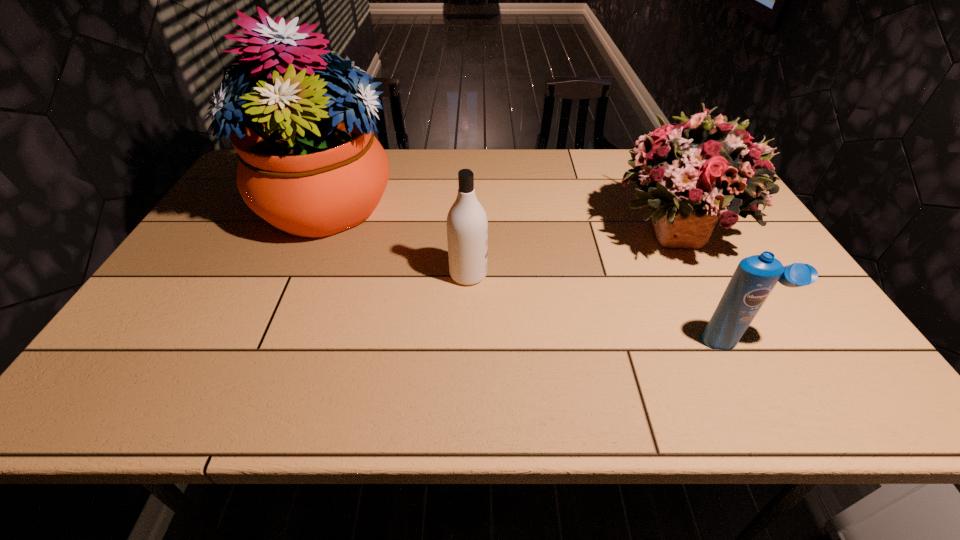
Where is `vacant space that is in between the right shampoo and the bouquet`? vacant space that is in between the right shampoo and the bouquet is located at coordinates (703, 285).

Identify the location of blank region between the second object from left to right and the nearest object. (601, 308).

Image resolution: width=960 pixels, height=540 pixels. Identify the location of vacant area that lies between the second object from left to right and the bouquet. (570, 252).

The width and height of the screenshot is (960, 540). I want to click on empty space between the bouquet and the nearer shampoo, so click(x=703, y=285).

At what (x,y) coordinates should I click in order to perform the action: click on free spot between the bouquet and the leftmost object. Please return your answer as a coordinate pair (x, y). Looking at the image, I should click on (501, 218).

Locate an element on the screen. This screenshot has width=960, height=540. empty space that is in between the nearest object and the tallest object is located at coordinates (532, 273).

Image resolution: width=960 pixels, height=540 pixels. I want to click on vacant area between the flower arrangement and the right shampoo, so click(532, 273).

The width and height of the screenshot is (960, 540). In order to click on blank region between the flower arrangement and the bouquet in this screenshot , I will do `click(501, 218)`.

Identify the location of vacant region between the bouquet and the nearer shampoo. Image resolution: width=960 pixels, height=540 pixels. (703, 285).

Locate an element on the screen. This screenshot has height=540, width=960. object that stands as the third closest to the bouquet is located at coordinates (310, 165).